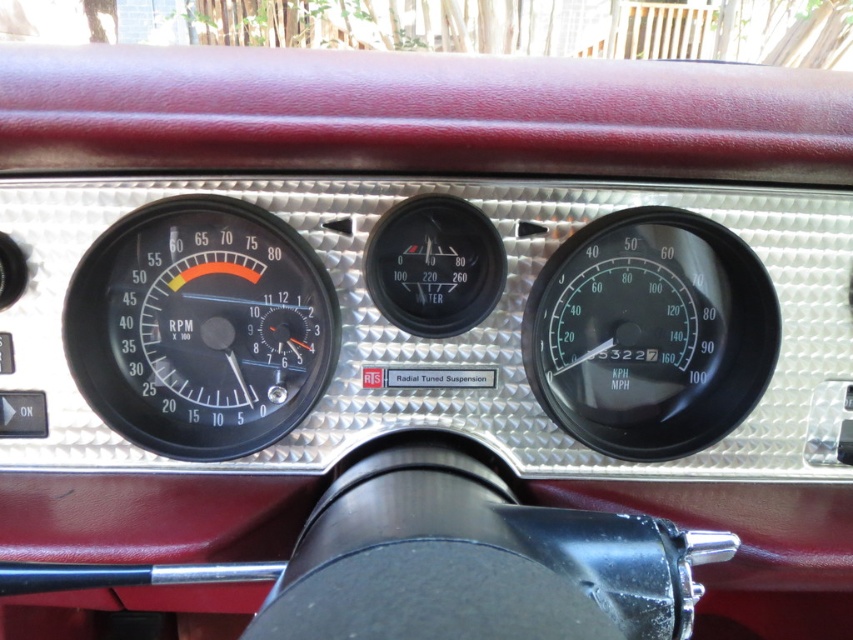
You are a mechanic working on a vintage car and need to install a new gauge between the black rubber tachometer at left and the black plastic speedometer at center right. The gauge you have is 30 centimeters wide. Will it fit in the space between them?

The distance between the black rubber tachometer at left and the black plastic speedometer at center right is 35.19 centimeters. Since the gauge is 30 centimeters wide, there is enough space to fit it between them.

Consider the image. You are a mechanic checking the dashboard of a vintage car. You need to access a specific point on the dashboard marked at coordinates point (x=123, y=262). The tool you have is 30 inches long. Can you reach that point with the tool?

The point (x=123, y=262) is 35.64 inches away from the camera, so the tool is 30 inches long, which is shorter than the required distance. Therefore, the tool cannot reach the point.

You are a mechanic checking the dashboard of a vintage car. You need to install a new gauge that requires more space than the existing ones. Which gauge should you replace to have enough space, the black rubber tachometer at left or the black plastic speedometer at center right?

The black rubber tachometer at left occupies less space than the black plastic speedometer at center right, so you should replace the black plastic speedometer at center right to have enough space for the new gauge.